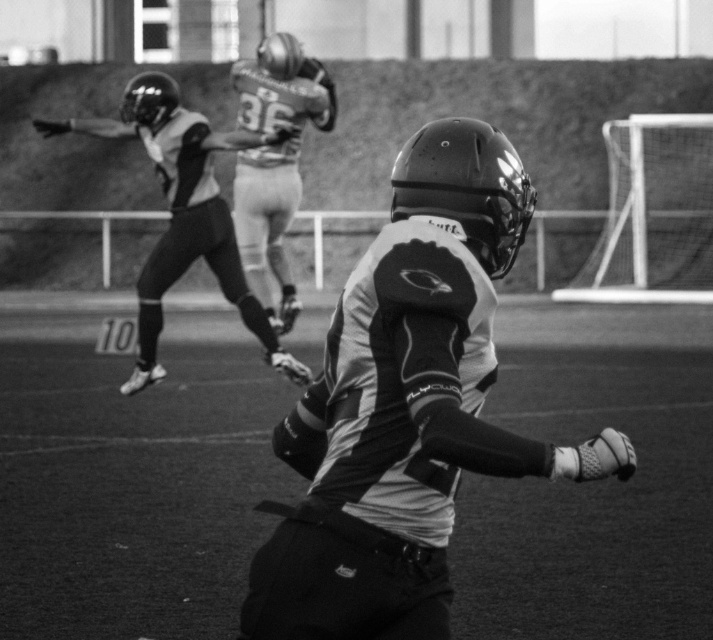
You are a quarterback in an American football game. You see the point at position [123,131] and want to throw a pass to it. The distance between you and the point is 11.00 meters. Your longest throw is 10.5 meters. Can you reach the point with your throw?

The distance between you and the point at position [123,131] is 11.00 meters, which is longer than your longest throw of 10.5 meters. Therefore, you cannot reach the point with your throw.

You are a referee watching the game. You notice the matte black helmet at center and the matte black jersey at upper left. Which object is closer to you?

The matte black helmet at center is closer to you because it is in front of the matte black jersey at upper left.

Based on the scene described, which of the two points, point [461,332] or point [237,266], is closer to the foreground player?

Point [461,332] is closer to the foreground player because it is in front of point [237,266].